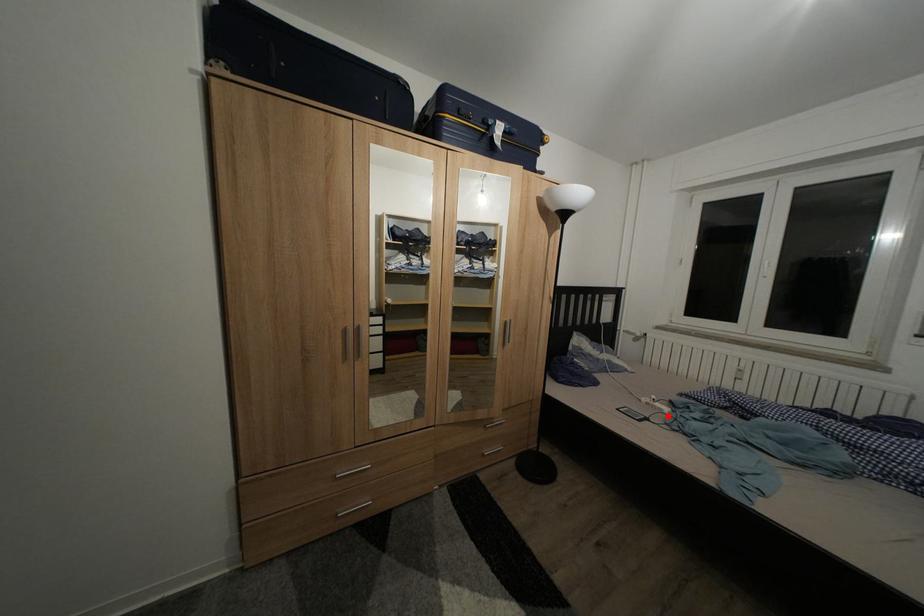
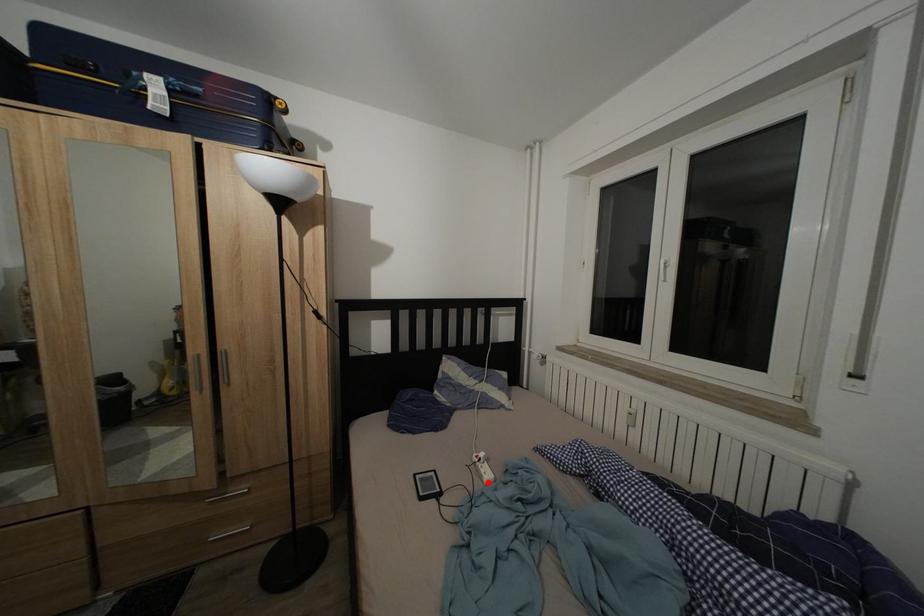
I am providing you with two images of the same scene from different viewpoints. A red point is marked on the first image and another point is marked on the second image. Is the marked point in image1 the same physical position as the marked point in image2?

Yes